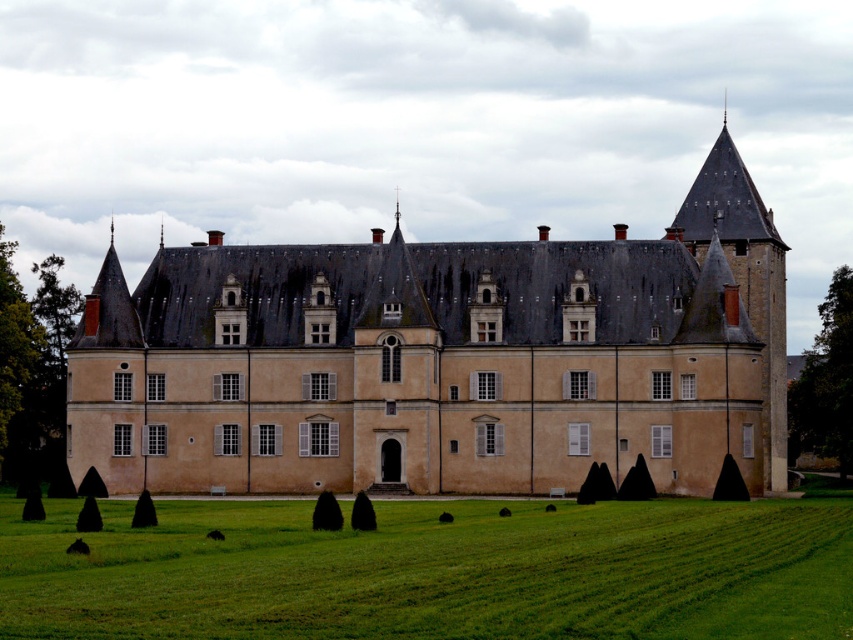
Question: Is beige stone castle at center wider than green grass at lower center?

Choices:
 (A) yes
 (B) no

Answer: (A)

Question: Does green leafy tree at left appear over green leafy tree at right?

Choices:
 (A) no
 (B) yes

Answer: (B)

Question: Is beige stone castle at center smaller than green leafy tree at right?

Choices:
 (A) no
 (B) yes

Answer: (A)

Question: Estimate the real-world distances between objects in this image. Which object is farther from the beige stone castle at center?

Choices:
 (A) green leafy tree at right
 (B) green grass at lower center

Answer: (A)

Question: Among these points, which one is farthest from the camera?

Choices:
 (A) (848, 392)
 (B) (44, 390)
 (C) (351, 333)
 (D) (223, 545)

Answer: (B)

Question: Which of the following is the farthest from the observer?

Choices:
 (A) (593, 509)
 (B) (712, 195)
 (C) (838, 390)
 (D) (33, 365)

Answer: (D)